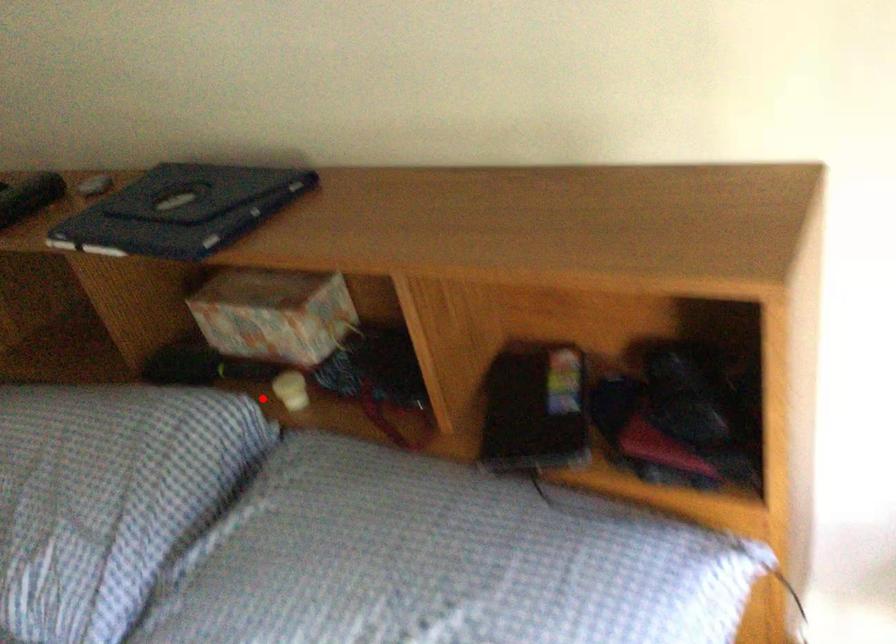
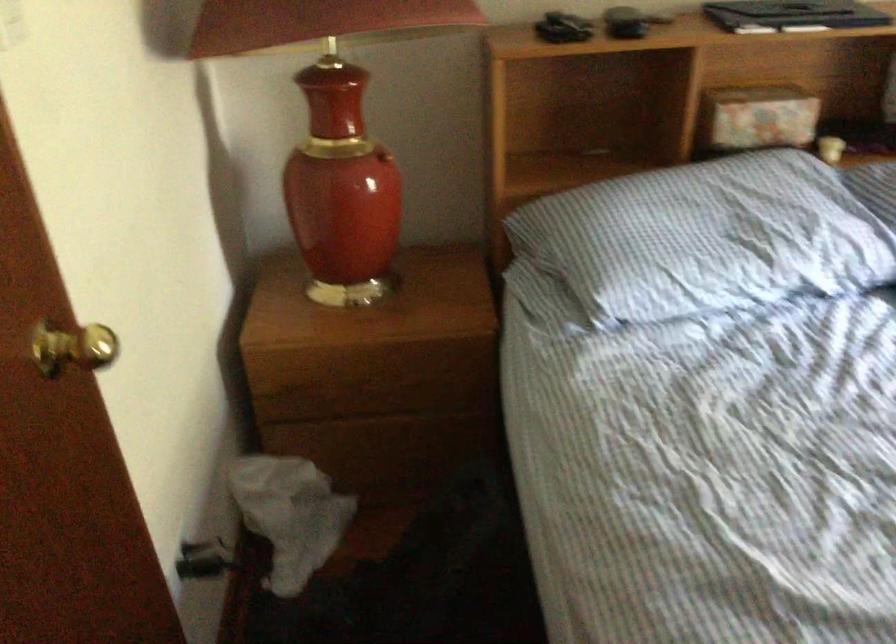
Where in the second image is the point corresponding to the highlighted location from the first image?

(830, 149)